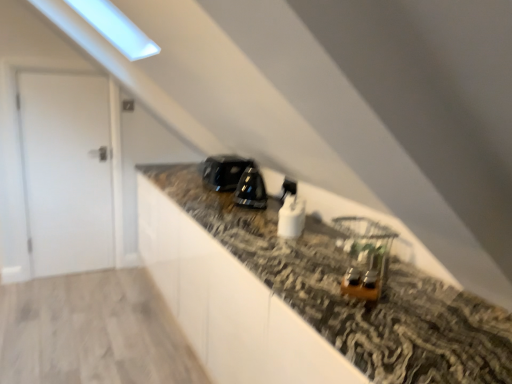
At what (x,y) coordinates should I click in order to perform the action: click on white glossy plug at center, the 4th appliance positioned from the left. Please return your answer as a coordinate pair (x, y). The width and height of the screenshot is (512, 384). Looking at the image, I should click on (288, 189).

The image size is (512, 384). What are the coordinates of `glossy black toaster at center, arranged as the 1th appliance when viewed from the left` in the screenshot? It's located at (224, 171).

Image resolution: width=512 pixels, height=384 pixels. In order to click on wooden earrings at center, the first appliance viewed from the right in this screenshot , I will do `click(367, 256)`.

Where is `white matte door at left`? white matte door at left is located at coordinates (67, 171).

Is point (257, 177) closer or farther from the camera than point (284, 226)?

Clearly, point (257, 177) is more distant from the camera than point (284, 226).

From the image's perspective, is black glossy kettle at center, marked as the third appliance in a front-to-back arrangement, beneath white glossy plug at center, marked as the second appliance in a front-to-back arrangement?

Incorrect, from the image's perspective, black glossy kettle at center, marked as the third appliance in a front-to-back arrangement, is higher than white glossy plug at center, marked as the second appliance in a front-to-back arrangement.

Could you measure the distance between black glossy kettle at center, marked as the third appliance in a front-to-back arrangement, and white glossy plug at center, the third appliance viewed from the left?

12.31 inches.

Considering the relative sizes of wooden earrings at center, arranged as the 5th appliance when viewed from the back, and white matte door at left in the image provided, is wooden earrings at center, arranged as the 5th appliance when viewed from the back, taller than white matte door at left?

→ In fact, wooden earrings at center, arranged as the 5th appliance when viewed from the back, may be shorter than white matte door at left.

At what (x,y) coordinates should I click in order to perform the action: click on the 5th appliance to the right of the white matte door at left, counting from the anchor's position. Please return your answer as a coordinate pair (x, y). The width and height of the screenshot is (512, 384). Looking at the image, I should click on (367, 256).

Could white matte door at left be considered to be inside wooden earrings at center, which ranks as the first appliance in front-to-back order?

Definitely not — white matte door at left is not inside wooden earrings at center, which ranks as the first appliance in front-to-back order.

From the image's perspective, is glossy black toaster at center, placed as the fifth appliance when sorted from front to back, above or below white glossy plug at center, which is counted as the fourth appliance, starting from the front?

Clearly, from the image's perspective, glossy black toaster at center, placed as the fifth appliance when sorted from front to back, is above white glossy plug at center, which is counted as the fourth appliance, starting from the front.

Is glossy black toaster at center, placed as the fifth appliance when sorted from front to back, looking in the opposite direction of white glossy plug at center, which is counted as the fourth appliance, starting from the front?

No, glossy black toaster at center, placed as the fifth appliance when sorted from front to back,'s orientation is not away from white glossy plug at center, which is counted as the fourth appliance, starting from the front.

From a real-world perspective, which is physically below, glossy black toaster at center, arranged as the 1th appliance when viewed from the left, or white glossy plug at center, the second appliance positioned from the back?

white glossy plug at center, the second appliance positioned from the back.

Is white glossy plug at center, the 4th appliance positioned from the left, inside glossy black toaster at center, placed as the fifth appliance when sorted from front to back?

No, white glossy plug at center, the 4th appliance positioned from the left, is not inside glossy black toaster at center, placed as the fifth appliance when sorted from front to back.

From a real-world perspective, is white glossy plug at center, which is counted as the fourth appliance, starting from the front, located beneath white matte door at left?

Incorrect, from a real-world perspective, white glossy plug at center, which is counted as the fourth appliance, starting from the front, is higher than white matte door at left.

Which of these two, white glossy plug at center, the 2th appliance viewed from the right, or white matte door at left, stands taller?

white matte door at left is taller.

Does white glossy plug at center, the second appliance positioned from the back, have a greater width compared to white matte door at left?

Incorrect, the width of white glossy plug at center, the second appliance positioned from the back, does not surpass that of white matte door at left.

In the scene shown: Is white glossy plug at center, the 4th appliance positioned from the left, turned away from white matte door at left?

No.

From the image's perspective, which object appears higher, white glossy plug at center, which appears as the fourth appliance when viewed from the back, or wooden earrings at center, arranged as the 5th appliance when viewed from the back?

white glossy plug at center, which appears as the fourth appliance when viewed from the back, from the image's perspective.

Consider the image. Between white glossy plug at center, the third appliance viewed from the left, and wooden earrings at center, the first appliance viewed from the right, which one appears on the left side from the viewer's perspective?

white glossy plug at center, the third appliance viewed from the left.

Can you tell me how much white glossy plug at center, marked as the second appliance in a front-to-back arrangement, and wooden earrings at center, the first appliance viewed from the right, differ in facing direction?

0.00599 degrees.

Is white glossy plug at center, marked as the second appliance in a front-to-back arrangement, far from wooden earrings at center, acting as the fifth appliance starting from the left?

That's not correct — white glossy plug at center, marked as the second appliance in a front-to-back arrangement, is a little close to wooden earrings at center, acting as the fifth appliance starting from the left.

Looking at this image, does white glossy plug at center, the third appliance viewed from the left, appear on the left side of white matte door at left?

In fact, white glossy plug at center, the third appliance viewed from the left, is to the right of white matte door at left.

Considering the sizes of white glossy plug at center, which is the third appliance in right-to-left order, and white matte door at left in the image, is white glossy plug at center, which is the third appliance in right-to-left order, wider or thinner than white matte door at left?

white glossy plug at center, which is the third appliance in right-to-left order, is wider than white matte door at left.

Choose the correct answer: Is white glossy plug at center, which is the third appliance in right-to-left order, inside white matte door at left or outside it?

white glossy plug at center, which is the third appliance in right-to-left order, is located beyond the bounds of white matte door at left.

Is there a large distance between wooden earrings at center, arranged as the 5th appliance when viewed from the back, and white glossy plug at center, which is the third appliance in right-to-left order?

wooden earrings at center, arranged as the 5th appliance when viewed from the back, is actually quite close to white glossy plug at center, which is the third appliance in right-to-left order.

Is wooden earrings at center, the first appliance viewed from the right, bigger or smaller than white glossy plug at center, which appears as the fourth appliance when viewed from the back?

Clearly, wooden earrings at center, the first appliance viewed from the right, is larger in size than white glossy plug at center, which appears as the fourth appliance when viewed from the back.

From the wooden earrings at center, the first appliance viewed from the right, count the 2nd appliance to the left and point to it. Please provide its 2D coordinates.

[(291, 217)]

Is point (357, 226) closer to camera compared to point (292, 206)?

Yes, point (357, 226) is closer to viewer.

Where is `appliance that is the 1st object located in front of the black glossy kettle at center, marked as the third appliance in a front-to-back arrangement`? appliance that is the 1st object located in front of the black glossy kettle at center, marked as the third appliance in a front-to-back arrangement is located at coordinates (291, 217).

Find the location of `door behind the wooden earrings at center, which ranks as the first appliance in front-to-back order`. door behind the wooden earrings at center, which ranks as the first appliance in front-to-back order is located at coordinates (67, 171).

When comparing their distances from white glossy plug at center, which is counted as the fourth appliance, starting from the front, does glossy black toaster at center, placed as the fifth appliance when sorted from front to back, or wooden earrings at center, which ranks as the first appliance in front-to-back order, seem further?

Result: glossy black toaster at center, placed as the fifth appliance when sorted from front to back, lies further to white glossy plug at center, which is counted as the fourth appliance, starting from the front, than the other object.

Based on their spatial positions, is black glossy kettle at center, marked as the 3th appliance in a back-to-front arrangement, or white matte door at left closer to white glossy plug at center, which is counted as the fourth appliance, starting from the front?

black glossy kettle at center, marked as the 3th appliance in a back-to-front arrangement, is positioned closer to the anchor white glossy plug at center, which is counted as the fourth appliance, starting from the front.

From the image, which object appears to be nearer to white glossy plug at center, which appears as the fourth appliance when viewed from the back, white glossy plug at center, the second appliance positioned from the back, or wooden earrings at center, the first appliance viewed from the right?

Among the two, white glossy plug at center, the second appliance positioned from the back, is located nearer to white glossy plug at center, which appears as the fourth appliance when viewed from the back.

Based on their spatial positions, is white glossy plug at center, which is counted as the fourth appliance, starting from the front, or white matte door at left further from black glossy kettle at center, marked as the 3th appliance in a back-to-front arrangement?

white matte door at left lies further to black glossy kettle at center, marked as the 3th appliance in a back-to-front arrangement, than the other object.

Consider the image. From the image, which object appears to be farther from white glossy plug at center, which is the third appliance in right-to-left order, black glossy kettle at center, marked as the 3th appliance in a back-to-front arrangement, or white matte door at left?

white matte door at left.

Considering their positions, is white glossy plug at center, which is counted as the fourth appliance, starting from the front, positioned closer to white glossy plug at center, which appears as the fourth appliance when viewed from the back, than white matte door at left?

Based on the image, white glossy plug at center, which is counted as the fourth appliance, starting from the front, appears to be nearer to white glossy plug at center, which appears as the fourth appliance when viewed from the back.

Considering their positions, is glossy black toaster at center, placed as the fifth appliance when sorted from front to back, positioned further to white matte door at left than wooden earrings at center, arranged as the 5th appliance when viewed from the back?

wooden earrings at center, arranged as the 5th appliance when viewed from the back, is further to white matte door at left.

Considering their positions, is white matte door at left positioned closer to black glossy kettle at center, marked as the third appliance in a front-to-back arrangement, than white glossy plug at center, the 2th appliance viewed from the right?

white glossy plug at center, the 2th appliance viewed from the right, lies closer to black glossy kettle at center, marked as the third appliance in a front-to-back arrangement, than the other object.

Locate an element on the screen. Image resolution: width=512 pixels, height=384 pixels. appliance between white glossy plug at center, marked as the second appliance in a front-to-back arrangement, and white glossy plug at center, the second appliance positioned from the back, from front to back is located at coordinates (251, 189).

You are a GUI agent. You are given a task and a screenshot of the screen. Output one action in this format:
    pyautogui.click(x=<x>, y=<y>)
    Task: Click on the appliance positioned between wooden earrings at center, arranged as the 5th appliance when viewed from the back, and black glossy kettle at center, which is the 2th appliance from left to right, from near to far
    This screenshot has width=512, height=384.
    Given the screenshot: What is the action you would take?
    pyautogui.click(x=291, y=217)

Locate an element on the screen. appliance located between white matte door at left and black glossy kettle at center, marked as the third appliance in a front-to-back arrangement, in the left-right direction is located at coordinates (224, 171).